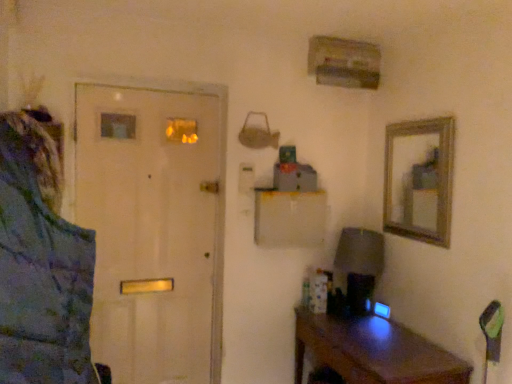
Where is `free space above brown wooden desk at lower right (from a real-world perspective)`? The image size is (512, 384). free space above brown wooden desk at lower right (from a real-world perspective) is located at coordinates (374, 332).